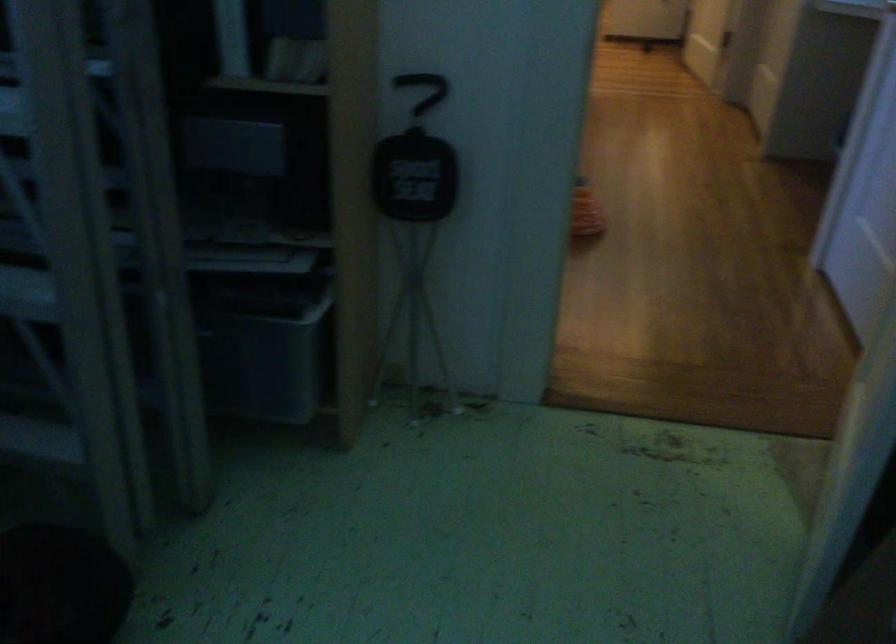
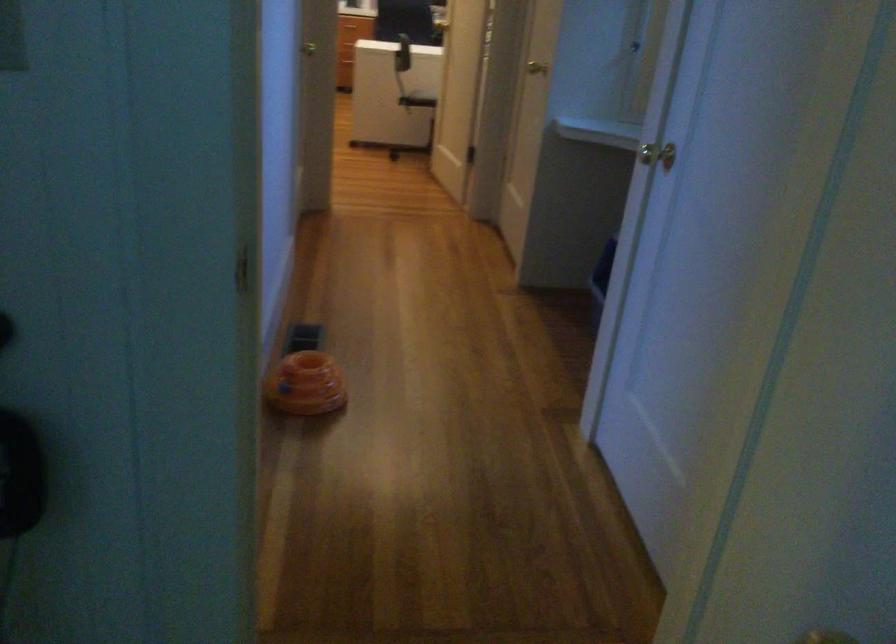
What movement of the cameraman would produce the second image?

The movement direction of the cameraman is right, forward.